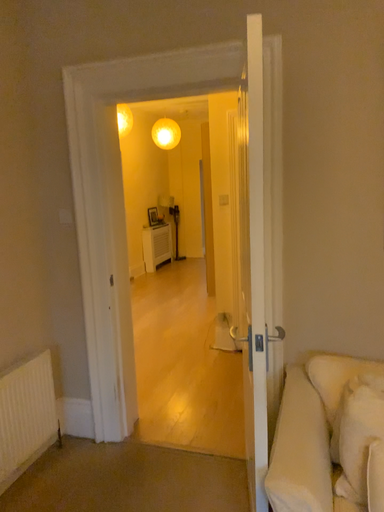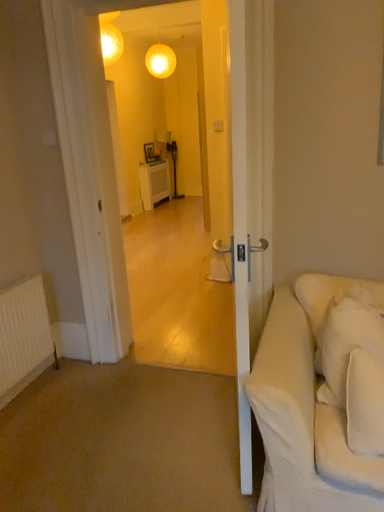
Question: Which way did the camera rotate in the video?

Choices:
 (A) rotated downward
 (B) rotated upward

Answer: (A)